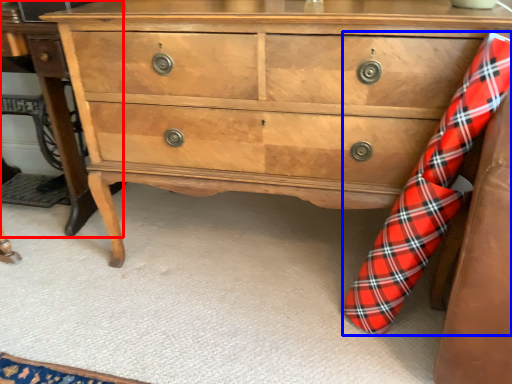
Question: Which object is further to the camera taking this photo, table (highlighted by a red box) or sock (highlighted by a blue box)?

Choices:
 (A) table
 (B) sock

Answer: (A)